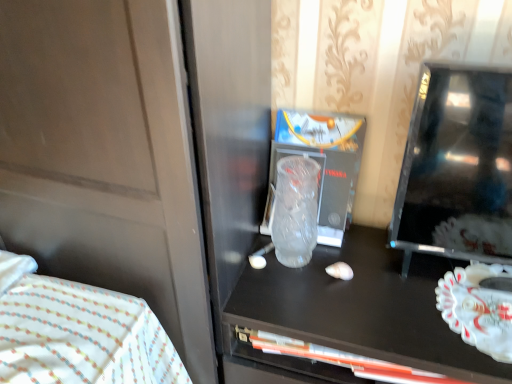
Question: Can you confirm if black glossy tv at right is thinner than transparent frosted glass at center?

Choices:
 (A) no
 (B) yes

Answer: (A)

Question: Is black glossy tv at right positioned with its back to transparent frosted glass at center?

Choices:
 (A) no
 (B) yes

Answer: (A)

Question: Can you confirm if black glossy tv at right is positioned to the right of transparent frosted glass at center?

Choices:
 (A) no
 (B) yes

Answer: (B)

Question: Does black glossy tv at right contain transparent frosted glass at center?

Choices:
 (A) yes
 (B) no

Answer: (B)

Question: From the image's perspective, is black glossy tv at right beneath transparent frosted glass at center?

Choices:
 (A) no
 (B) yes

Answer: (A)

Question: Is black glossy tv at right taller than transparent frosted glass at center?

Choices:
 (A) no
 (B) yes

Answer: (B)

Question: Is transparent frosted glass at center at the left side of black glossy tv at right?

Choices:
 (A) no
 (B) yes

Answer: (B)

Question: Considering the relative sizes of transparent frosted glass at center and black glossy tv at right in the image provided, is transparent frosted glass at center taller than black glossy tv at right?

Choices:
 (A) yes
 (B) no

Answer: (B)

Question: Is transparent frosted glass at center bigger than black glossy tv at right?

Choices:
 (A) no
 (B) yes

Answer: (A)

Question: From a real-world perspective, does transparent frosted glass at center stand above black glossy tv at right?

Choices:
 (A) no
 (B) yes

Answer: (A)

Question: Is transparent frosted glass at center positioned far away from black glossy tv at right?

Choices:
 (A) yes
 (B) no

Answer: (B)

Question: Can you confirm if transparent frosted glass at center is wider than black glossy tv at right?

Choices:
 (A) yes
 (B) no

Answer: (B)

Question: Is transparent frosted glass at center looking in the opposite direction of white fabric bed at lower left?

Choices:
 (A) yes
 (B) no

Answer: (B)